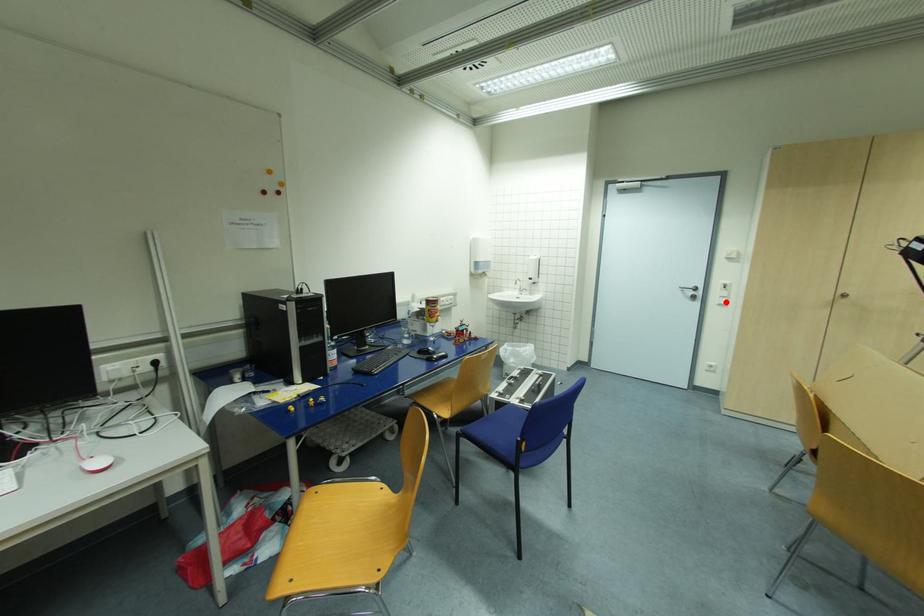
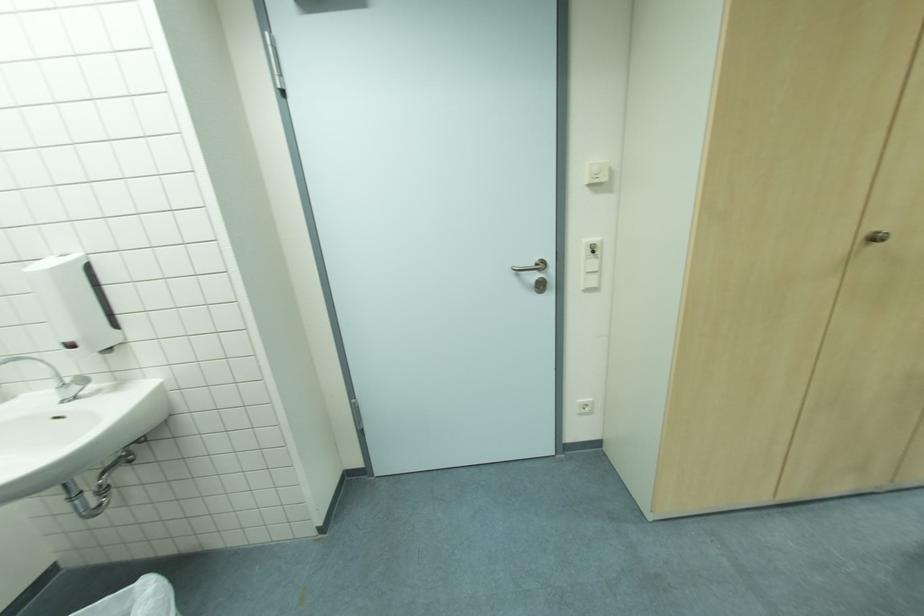
The point at the highlighted location is marked in the first image. Where is the corresponding point in the second image?

(598, 285)